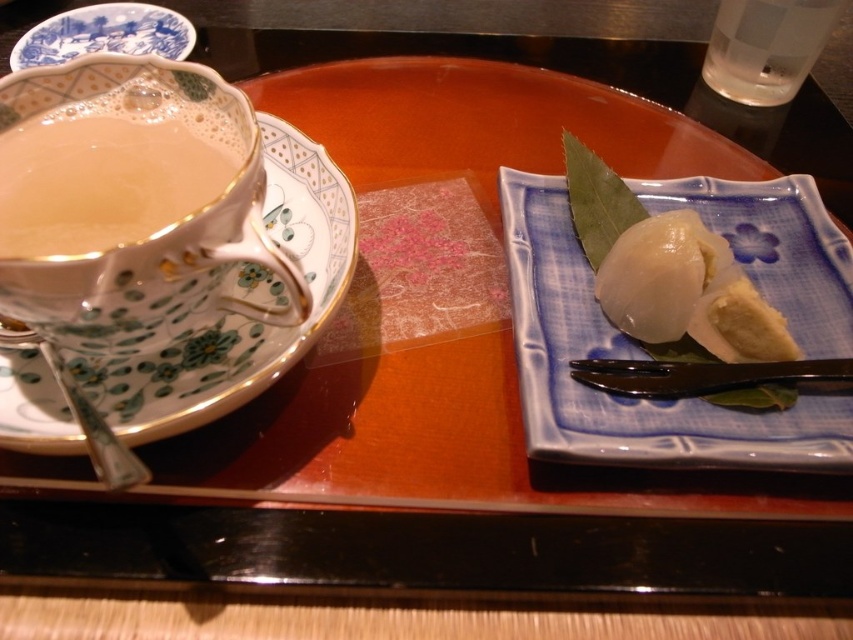
Can you confirm if translucent porcelain cup at left is thinner than blue porcelain plate at upper left?

Indeed, translucent porcelain cup at left has a lesser width compared to blue porcelain plate at upper left.

Is point (109, 177) closer to viewer compared to point (125, 29)?

Yes, point (109, 177) is in front of point (125, 29).

Which is in front, point (184, 177) or point (97, 44)?

Positioned in front is point (184, 177).

You are a GUI agent. You are given a task and a screenshot of the screen. Output one action in this format:
    pyautogui.click(x=<x>, y=<y>)
    Task: Click on the translucent porcelain cup at left
    This screenshot has height=640, width=853.
    Given the screenshot: What is the action you would take?
    pyautogui.click(x=109, y=172)

Does white porcelain dumplings at center have a lesser width compared to translucent porcelain cup at left?

Incorrect, white porcelain dumplings at center's width is not less than translucent porcelain cup at left's.

Is white porcelain dumplings at center bigger than translucent porcelain cup at left?

Indeed, white porcelain dumplings at center has a larger size compared to translucent porcelain cup at left.

Which is behind, point (662, 410) or point (62, 148)?

Point (662, 410)

Find the location of a particular element. white porcelain dumplings at center is located at coordinates (628, 356).

Does white porcelain dumplings at center come in front of blue porcelain plate at upper left?

Yes, white porcelain dumplings at center is closer to the viewer.

Is point (618, 433) closer to camera compared to point (47, 22)?

Yes, it is in front of point (47, 22).

Is point (820, 244) positioned before point (143, 42)?

That is True.

Identify the location of white porcelain dumplings at center. This screenshot has width=853, height=640. (628, 356).